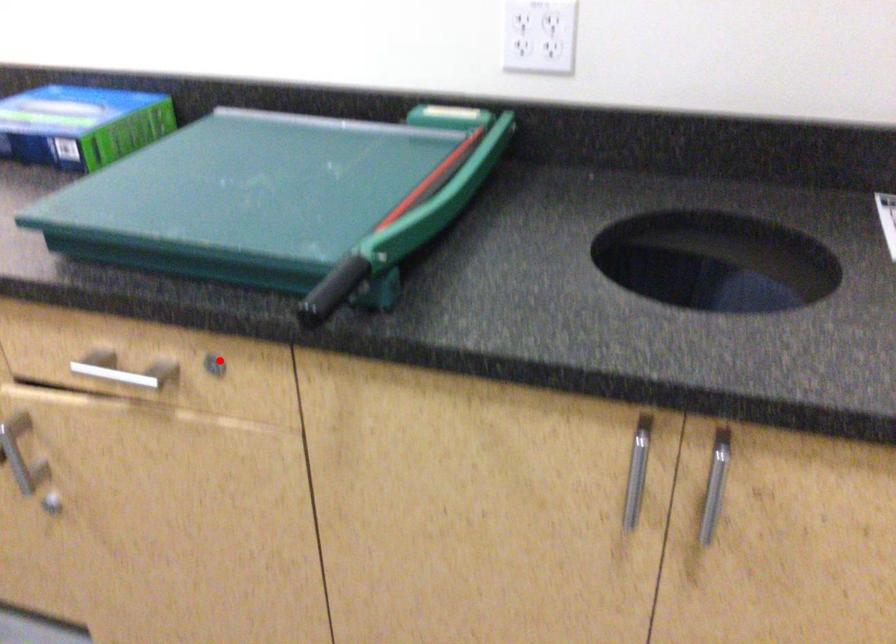
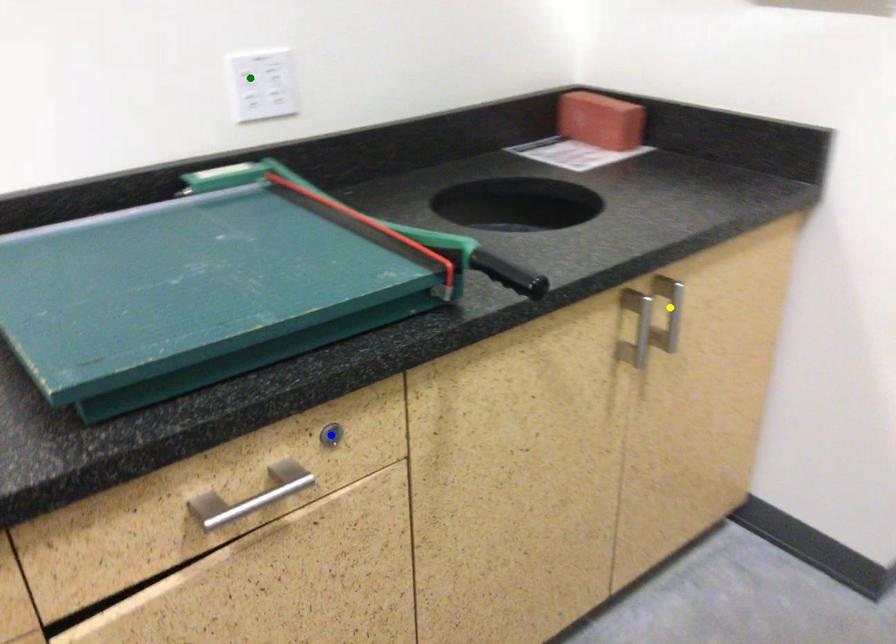
Question: I am providing you with two images of the same scene from different viewpoints. A red point is marked on the first image. You are given multiple points on the second image. Which point in image 2 represents the same 3d spot as the red point in image 1?

Choices:
 (A) yellow point
 (B) blue point
 (C) green point

Answer: (B)